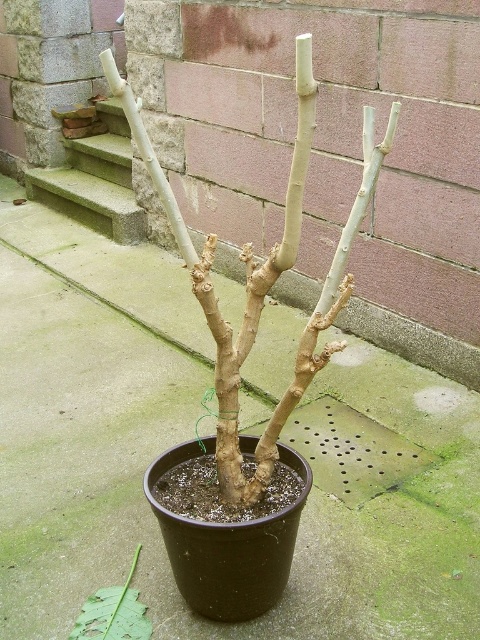
Question: Among these points, which one is nearest to the camera?

Choices:
 (A) (109, 612)
 (B) (201, 278)
 (C) (104, 109)

Answer: (B)

Question: Is green concrete stairs at upper left bigger than green leafy stem at center?

Choices:
 (A) no
 (B) yes

Answer: (B)

Question: Which point appears farthest from the camera in this image?

Choices:
 (A) (88, 616)
 (B) (307, 365)
 (C) (104, 224)

Answer: (C)

Question: Among these points, which one is nearest to the camera?

Choices:
 (A) (80, 634)
 (B) (120, 88)

Answer: (B)

Question: Is smooth beige branches at center positioned at the back of green concrete stairs at upper left?

Choices:
 (A) no
 (B) yes

Answer: (A)

Question: Can you confirm if smooth beige branches at center is thinner than green concrete stairs at upper left?

Choices:
 (A) yes
 (B) no

Answer: (A)